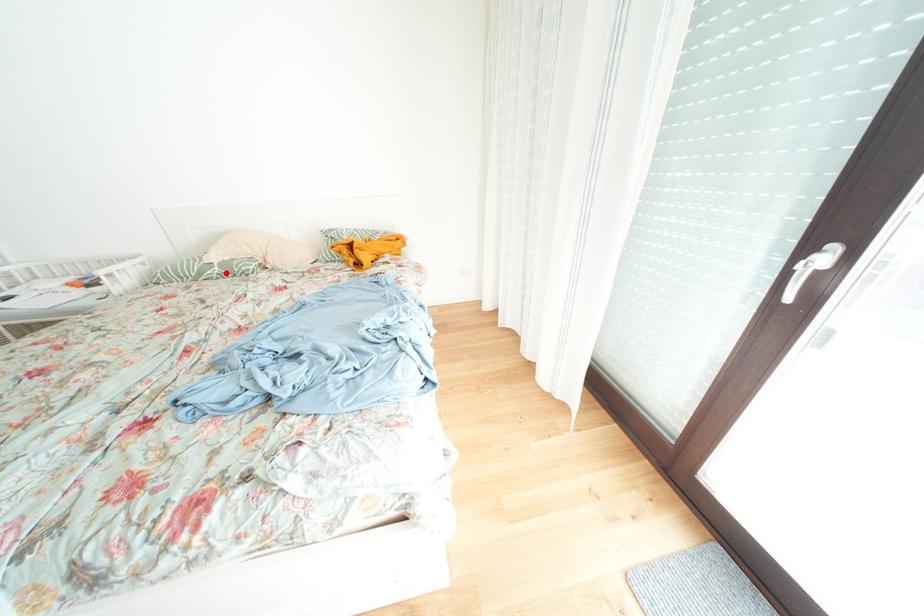
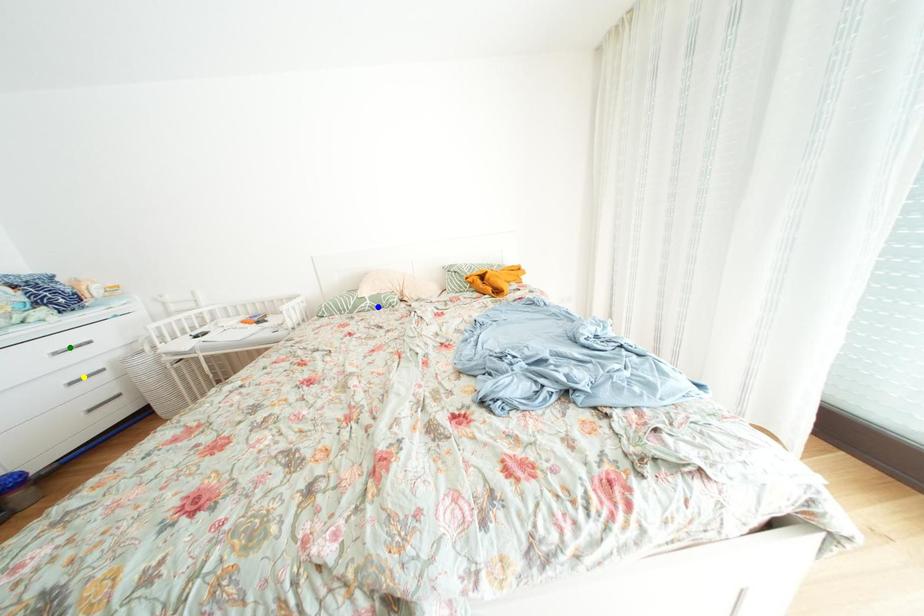
Question: I am providing you with two images of the same scene from different viewpoints. A red point is marked on the first image. You are given multiple points on the second image. Which point in image 2 represents the same 3d spot as the red point in image 1?

Choices:
 (A) blue point
 (B) yellow point
 (C) green point

Answer: (A)